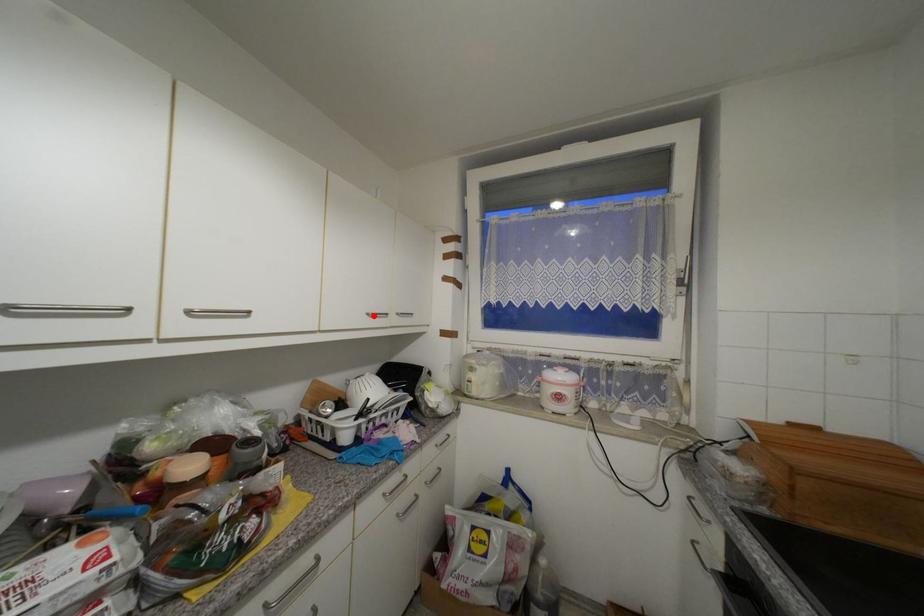
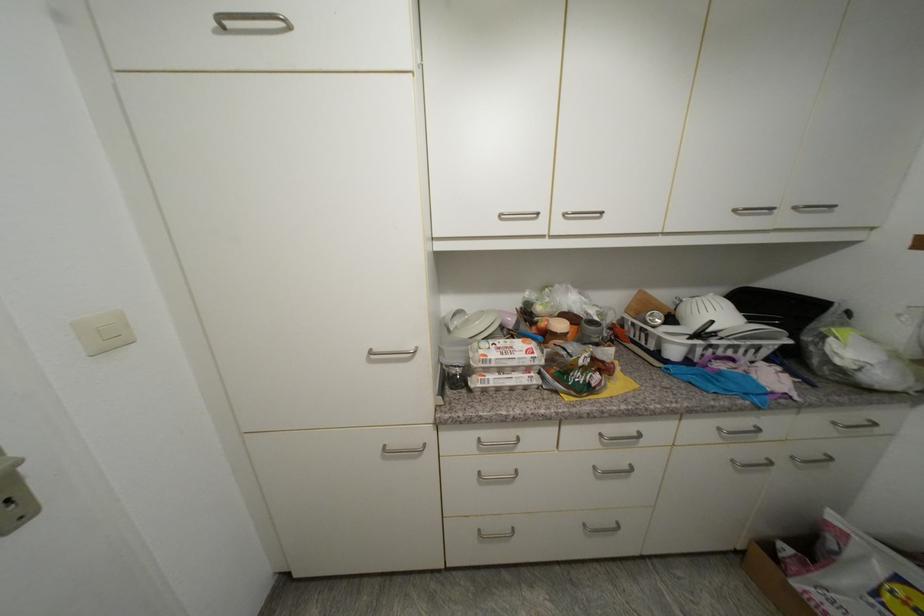
Question: I am providing you with two images of the same scene from different viewpoints. A red point is marked on the first image. At the location where the point appears in image 1, is it still visible in image 2?

Choices:
 (A) Yes
 (B) No

Answer: (A)